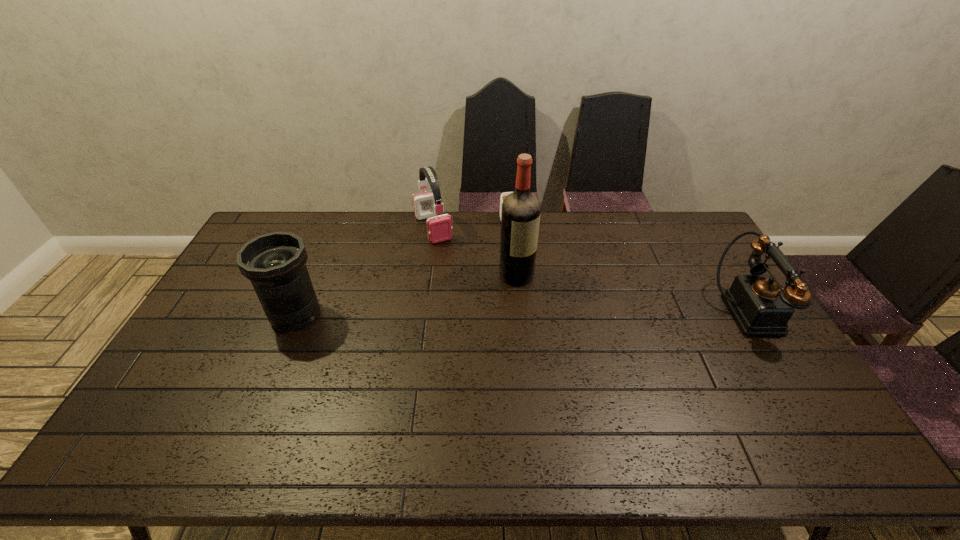
Locate an element on the screen. telephoto lens is located at coordinates (275, 263).

This screenshot has height=540, width=960. In order to click on telephone in this screenshot , I will do `click(761, 306)`.

Where is `liquor`? The image size is (960, 540). liquor is located at coordinates (520, 217).

The height and width of the screenshot is (540, 960). What are the coordinates of `the fourth object from right to left` in the screenshot? It's located at (428, 205).

Locate an element on the screen. cup is located at coordinates click(503, 195).

The height and width of the screenshot is (540, 960). Identify the location of vacant space situated on the back of the telephoto lens. (310, 280).

Locate an element on the screen. The height and width of the screenshot is (540, 960). vacant space located 0.110m on the front-facing side of the tallest object is located at coordinates (558, 299).

The height and width of the screenshot is (540, 960). Identify the location of blank space located 0.250m on the front-facing side of the tallest object. (595, 321).

The image size is (960, 540). What are the coordinates of `free spot located 0.330m on the front-facing side of the tallest object` in the screenshot? It's located at (619, 334).

Locate an element on the screen. This screenshot has width=960, height=540. vacant space located 0.160m on the outer surface of the earphone is located at coordinates (455, 271).